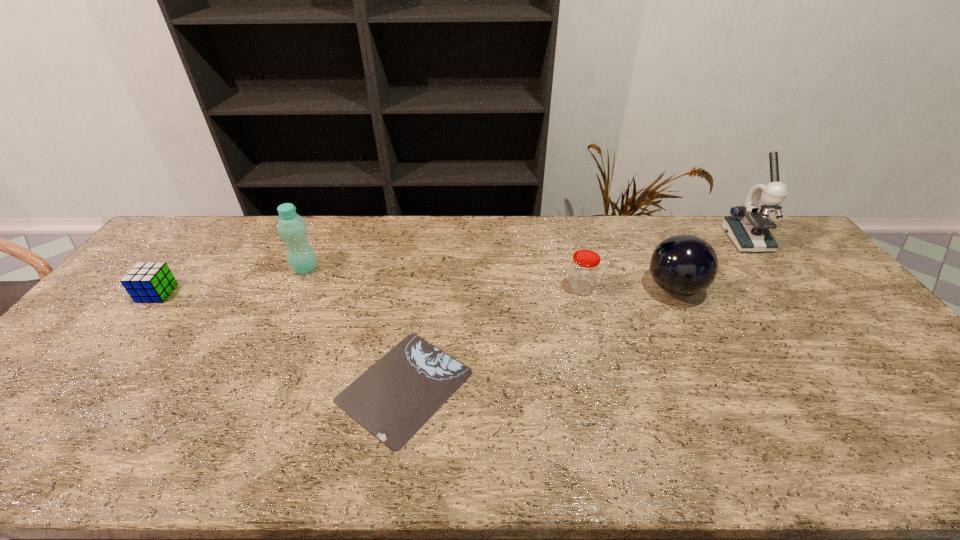
In order to click on the farthest object in this screenshot , I will do `click(748, 226)`.

I want to click on microscope, so click(x=748, y=226).

This screenshot has width=960, height=540. In order to click on the second tallest object in this screenshot , I will do `click(292, 228)`.

Where is `bottle`? This screenshot has height=540, width=960. bottle is located at coordinates (292, 228).

In order to click on the fourth shortest object in this screenshot , I will do `click(683, 265)`.

Locate an element on the screen. The image size is (960, 540). the second object from right to left is located at coordinates point(683,265).

Image resolution: width=960 pixels, height=540 pixels. Identify the location of the third shortest object. (584, 269).

Identify the location of jar. (584, 269).

I want to click on cube, so click(151, 282).

Identify the location of the second shortest object. This screenshot has height=540, width=960. (151, 282).